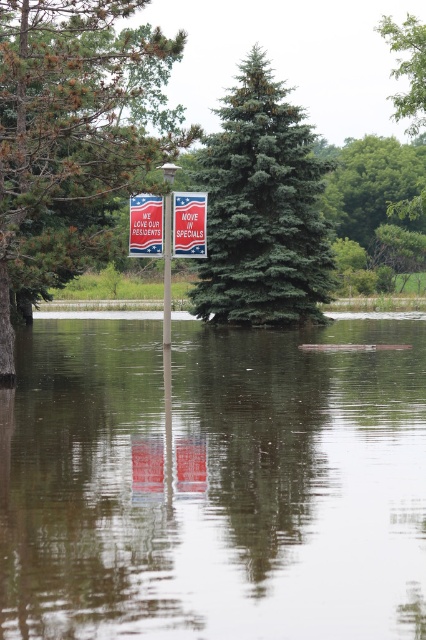
Question: Is metallic silver sign at center thinner than metallic pole at center?

Choices:
 (A) no
 (B) yes

Answer: (B)

Question: Which point is closer to the camera?

Choices:
 (A) white paper sign at center
 (B) clear water at center
 (C) metallic pole at center
 (D) green matte tree at center

Answer: (B)

Question: Does green textured pine tree at center have a larger size compared to metallic silver sign at center?

Choices:
 (A) no
 (B) yes

Answer: (B)

Question: Can you confirm if green textured pine tree at center is positioned below green matte tree at center?

Choices:
 (A) no
 (B) yes

Answer: (A)

Question: Which object is positioned closest to the clear water at center?

Choices:
 (A) metallic silver sign at center
 (B) green leafy tree at upper right
 (C) white paper sign at center
 (D) red plastic sign at center

Answer: (A)

Question: Which of the following is the farthest from the observer?

Choices:
 (A) (158, 237)
 (B) (187, 221)
 (C) (368, 605)

Answer: (B)